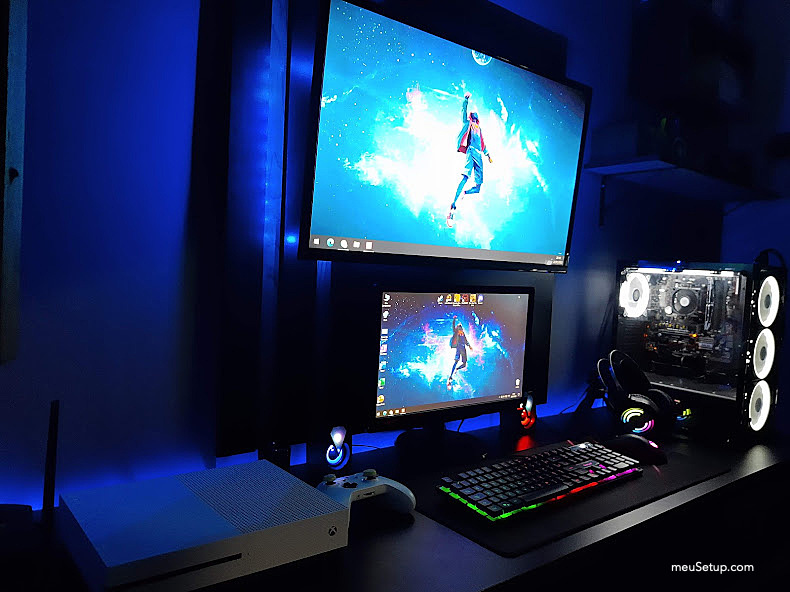
Find the location of `keyboard`. keyboard is located at coordinates (567, 472).